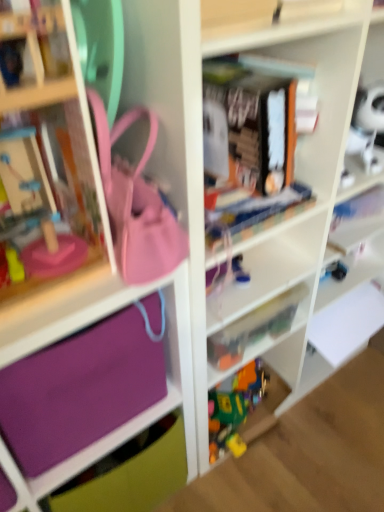
Where is `blank space to the left of matte pink purse at center`? blank space to the left of matte pink purse at center is located at coordinates (52, 275).